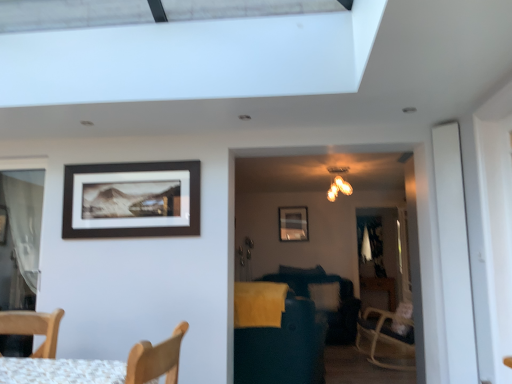
What is the approximate height of matte black picture frame at upper center, which is counted as the 2th picture frame, starting from the top?

The height of matte black picture frame at upper center, which is counted as the 2th picture frame, starting from the top, is 24.48 inches.

Measure the distance between point (306, 226) and camera.

They are 23.73 feet apart.

The height and width of the screenshot is (384, 512). Describe the element at coordinates (454, 254) in the screenshot. I see `white glossy screen door at right` at that location.

Find the location of a particular element. The height and width of the screenshot is (384, 512). matte black picture frame at upper center, positioned as the 2th picture frame in front-to-back order is located at coordinates (293, 223).

Which point is more forward, [338,191] or [317,302]?

Positioned in front is point [317,302].

Which of these two, matte gold chandelier at upper center or white fabric pillow at center, is bigger?

With larger size is white fabric pillow at center.

Where is `light fixture on the left of white fabric pillow at center`? light fixture on the left of white fabric pillow at center is located at coordinates (338, 188).

From a real-world perspective, is matte black picture frame at upper center, which is the 2th picture frame from back to front, on white fabric pillow at center?

Yes, from a real-world perspective, matte black picture frame at upper center, which is the 2th picture frame from back to front, is over white fabric pillow at center

Which of these two, matte black picture frame at upper center, positioned as the 1th picture frame in top-to-bottom order, or white fabric pillow at center, is wider?

With larger width is white fabric pillow at center.

Is matte black picture frame at upper center, which is the 2th picture frame in bottom-to-top order, oriented towards white fabric pillow at center?

No, matte black picture frame at upper center, which is the 2th picture frame in bottom-to-top order, is not turned towards white fabric pillow at center.

Based on their sizes in the image, would you say matte black picture frame at upper center, marked as the 1th picture frame in a front-to-back arrangement, is bigger or smaller than white fabric pillow at center?

Considering their sizes, matte black picture frame at upper center, marked as the 1th picture frame in a front-to-back arrangement, takes up less space than white fabric pillow at center.

Is point (334, 168) in front of point (260, 285)?

That is False.

Is matte gold chandelier at upper center positioned beyond the bounds of dark blue fabric swivel chair at center?

Yes, matte gold chandelier at upper center is outside of dark blue fabric swivel chair at center.

Considering the relative sizes of matte gold chandelier at upper center and dark blue fabric swivel chair at center in the image provided, is matte gold chandelier at upper center wider than dark blue fabric swivel chair at center?

No.

Measure the distance between matte gold chandelier at upper center and dark blue fabric swivel chair at center.

The distance of matte gold chandelier at upper center from dark blue fabric swivel chair at center is 3.43 meters.

Is white fabric pillow at center facing away from white glossy screen door at right?

No, white fabric pillow at center is not facing the opposite direction of white glossy screen door at right.

Considering the relative sizes of white fabric pillow at center and white glossy screen door at right in the image provided, is white fabric pillow at center smaller than white glossy screen door at right?

Incorrect, white fabric pillow at center is not smaller in size than white glossy screen door at right.

Is white fabric pillow at center outside of white glossy screen door at right?

Yes, white fabric pillow at center is located beyond the bounds of white glossy screen door at right.

Which is farther, (x=312, y=293) or (x=458, y=188)?

The point (x=312, y=293) is more distant.

Is white fabric pillow at center spatially inside matte black picture frame at upper center, placed as the 2th picture frame when sorted from left to right, or outside of it?

white fabric pillow at center is outside matte black picture frame at upper center, placed as the 2th picture frame when sorted from left to right.

From a real-world perspective, does white fabric pillow at center stand above matte black picture frame at upper center, which is counted as the 2th picture frame, starting from the top?

Actually, white fabric pillow at center is physically below matte black picture frame at upper center, which is counted as the 2th picture frame, starting from the top, in the real world.

Can you tell me how much white fabric pillow at center and matte black picture frame at upper center, placed as the 2th picture frame when sorted from left to right, differ in facing direction?

The angular difference between white fabric pillow at center and matte black picture frame at upper center, placed as the 2th picture frame when sorted from left to right, is 0.405 degrees.

From the image's perspective, is white fabric pillow at center under matte black picture frame at upper center, which ranks as the first picture frame in bottom-to-top order?

Correct, white fabric pillow at center appears lower than matte black picture frame at upper center, which ranks as the first picture frame in bottom-to-top order, in the image.

From the image's perspective, is matte black picture frame at upper center, placed as the 2th picture frame when sorted from left to right, beneath white fabric pillow at center?

No.

Can you confirm if matte black picture frame at upper center, which is counted as the 2th picture frame, starting from the top, is positioned to the right of white fabric pillow at center?

Incorrect, matte black picture frame at upper center, which is counted as the 2th picture frame, starting from the top, is not on the right side of white fabric pillow at center.

Can we say matte black picture frame at upper center, positioned as the 1th picture frame in back-to-front order, lies outside white fabric pillow at center?

Indeed, matte black picture frame at upper center, positioned as the 1th picture frame in back-to-front order, is completely outside white fabric pillow at center.

Which is less distant, (291, 239) or (311, 297)?

Positioned in front is point (311, 297).

Measure the distance between white glossy screen door at right and matte black picture frame at upper center, positioned as the 2th picture frame in front-to-back order.

They are 4.29 meters apart.

From the image's perspective, between white glossy screen door at right and matte black picture frame at upper center, which ranks as the first picture frame in bottom-to-top order, who is located below?

From the image's view, matte black picture frame at upper center, which ranks as the first picture frame in bottom-to-top order, is below.

Is white glossy screen door at right bigger or smaller than matte black picture frame at upper center, which is counted as the 2th picture frame, starting from the top?

Clearly, white glossy screen door at right is larger in size than matte black picture frame at upper center, which is counted as the 2th picture frame, starting from the top.

From a real-world perspective, does white glossy screen door at right sit lower than matte black picture frame at upper center, which ranks as the first picture frame in bottom-to-top order?

Yes, from a real-world perspective, white glossy screen door at right is below matte black picture frame at upper center, which ranks as the first picture frame in bottom-to-top order.

In the image, there is a white fabric pillow at center. Identify the location of light fixture above it (from the image's perspective). This screenshot has height=384, width=512. (338, 188).

This screenshot has width=512, height=384. I want to click on pillow lying on the right of matte black picture frame at upper center, the 1th picture frame viewed from the left, so click(x=325, y=295).

Estimate the real-world distances between objects in this image. Which object is further from matte gold chandelier at upper center, matte black picture frame at upper center, which ranks as the 1th picture frame in right-to-left order, or white glossy screen door at right?

white glossy screen door at right lies further to matte gold chandelier at upper center than the other object.

Looking at the image, which one is located closer to matte black picture frame at upper center, the 1th picture frame viewed from the left, dark blue fabric swivel chair at center or white glossy screen door at right?

The object closer to matte black picture frame at upper center, the 1th picture frame viewed from the left, is dark blue fabric swivel chair at center.

Which object lies nearer to the anchor point white glossy screen door at right, matte black picture frame at upper center, which is counted as the 2th picture frame, starting from the top, or white fabric pillow at center?

white fabric pillow at center is closer to white glossy screen door at right.

From the image, which object appears to be farther from matte black picture frame at upper center, which is the 2th picture frame from back to front, matte black picture frame at upper center, positioned as the 1th picture frame in back-to-front order, or white fabric pillow at center?

matte black picture frame at upper center, positioned as the 1th picture frame in back-to-front order.

Estimate the real-world distances between objects in this image. Which object is further from dark blue fabric swivel chair at center, white fabric pillow at center or white glossy screen door at right?

Among the two, white fabric pillow at center is located further to dark blue fabric swivel chair at center.

Which object lies nearer to the anchor point matte gold chandelier at upper center, white fabric pillow at center or matte black picture frame at upper center, which is the 2th picture frame from back to front?

white fabric pillow at center is closer to matte gold chandelier at upper center.

Based on their spatial positions, is white glossy screen door at right or white fabric pillow at center closer to dark blue fabric swivel chair at center?

white glossy screen door at right.

Which object lies nearer to the anchor point matte black picture frame at upper center, marked as the 1th picture frame in a front-to-back arrangement, white fabric pillow at center or white glossy screen door at right?

The object closer to matte black picture frame at upper center, marked as the 1th picture frame in a front-to-back arrangement, is white glossy screen door at right.

Find the location of `picture frame between white glossy screen door at right and white fabric pillow at center from front to back`. picture frame between white glossy screen door at right and white fabric pillow at center from front to back is located at coordinates (131, 200).

This screenshot has height=384, width=512. In order to click on light fixture located between matte black picture frame at upper center, which is the 2th picture frame from right to left, and white fabric pillow at center in the depth direction in this screenshot , I will do `click(338, 188)`.

The height and width of the screenshot is (384, 512). In order to click on light fixture positioned between white glossy screen door at right and white fabric pillow at center from near to far in this screenshot , I will do `click(338, 188)`.

Image resolution: width=512 pixels, height=384 pixels. I want to click on swivel chair between matte black picture frame at upper center, which is the 2th picture frame from right to left, and white glossy screen door at right from left to right, so click(276, 336).